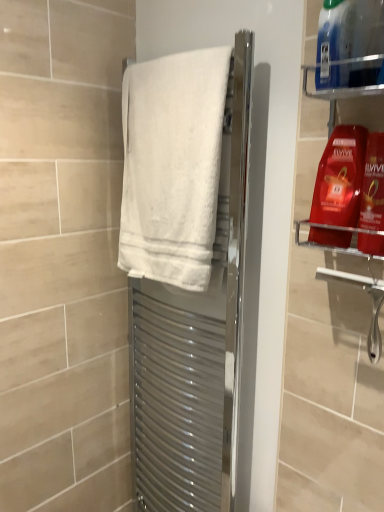
Question: Should I look upward or downward to see shiny red plastic shampoo bottle at upper right, placed as the first cleaning product when sorted from bottom to top?

Choices:
 (A) up
 (B) down

Answer: (A)

Question: Does shiny red shampoo at upper right, which appears as the second cleaning product when viewed from the top, have a lesser width compared to blue plastic bottle at upper right, marked as the 3th cleaning product in a bottom-to-top arrangement?

Choices:
 (A) yes
 (B) no

Answer: (A)

Question: Considering the relative sizes of shiny red shampoo at upper right, which appears as the second cleaning product when viewed from the top, and blue plastic bottle at upper right, marked as the first cleaning product in a top-to-bottom arrangement, in the image provided, is shiny red shampoo at upper right, which appears as the second cleaning product when viewed from the top, wider than blue plastic bottle at upper right, marked as the first cleaning product in a top-to-bottom arrangement,?

Choices:
 (A) yes
 (B) no

Answer: (B)

Question: Is shiny red shampoo at upper right, which appears as the second cleaning product when ordered from the bottom, oriented towards blue plastic bottle at upper right, marked as the first cleaning product in a top-to-bottom arrangement?

Choices:
 (A) no
 (B) yes

Answer: (A)

Question: Is the surface of shiny red shampoo at upper right, which appears as the second cleaning product when ordered from the bottom, in direct contact with blue plastic bottle at upper right, marked as the 3th cleaning product in a bottom-to-top arrangement?

Choices:
 (A) yes
 (B) no

Answer: (B)

Question: From the image's perspective, does shiny red shampoo at upper right, which appears as the second cleaning product when viewed from the top, appear higher than blue plastic bottle at upper right, marked as the first cleaning product in a top-to-bottom arrangement?

Choices:
 (A) no
 (B) yes

Answer: (A)

Question: Is shiny red shampoo at upper right, which appears as the second cleaning product when ordered from the bottom, at the left side of blue plastic bottle at upper right, marked as the 3th cleaning product in a bottom-to-top arrangement?

Choices:
 (A) yes
 (B) no

Answer: (B)

Question: From the image's perspective, is blue plastic bottle at upper right, marked as the 3th cleaning product in a bottom-to-top arrangement, located above white fabric towel at center?

Choices:
 (A) yes
 (B) no

Answer: (A)

Question: Is blue plastic bottle at upper right, marked as the first cleaning product in a top-to-bottom arrangement, facing towards white fabric towel at center?

Choices:
 (A) no
 (B) yes

Answer: (A)

Question: Can you confirm if blue plastic bottle at upper right, marked as the first cleaning product in a top-to-bottom arrangement, is smaller than white fabric towel at center?

Choices:
 (A) no
 (B) yes

Answer: (B)

Question: Considering the relative sizes of blue plastic bottle at upper right, marked as the 3th cleaning product in a bottom-to-top arrangement, and white fabric towel at center in the image provided, is blue plastic bottle at upper right, marked as the 3th cleaning product in a bottom-to-top arrangement, wider than white fabric towel at center?

Choices:
 (A) no
 (B) yes

Answer: (A)

Question: Can you confirm if blue plastic bottle at upper right, marked as the first cleaning product in a top-to-bottom arrangement, is thinner than white fabric towel at center?

Choices:
 (A) yes
 (B) no

Answer: (A)

Question: Is the position of blue plastic bottle at upper right, marked as the 3th cleaning product in a bottom-to-top arrangement, less distant than that of white fabric towel at center?

Choices:
 (A) yes
 (B) no

Answer: (A)

Question: Is white cotton towel at center facing towards shiny red plastic shampoo bottle at upper right, which is counted as the third cleaning product, starting from the top?

Choices:
 (A) no
 (B) yes

Answer: (A)